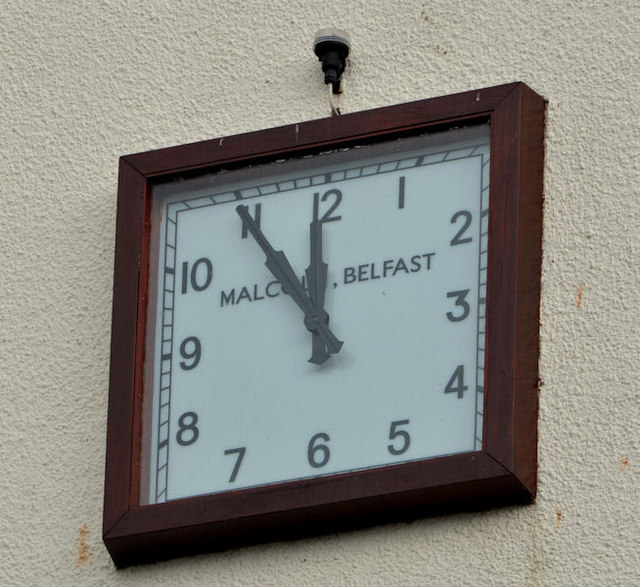
The width and height of the screenshot is (640, 587). What are the coordinates of `8 brown spots on right side of clock` in the screenshot? It's located at (561, 512), (620, 461), (541, 556), (577, 296), (544, 381), (537, 343), (537, 323), (598, 236).